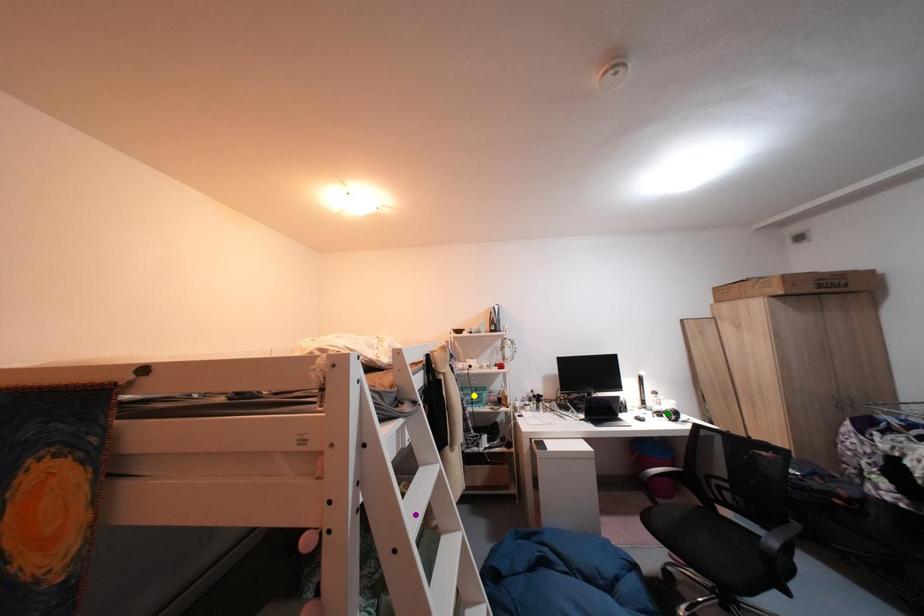
Order these from nearest to farthest:
A) yellow point
B) purple point
C) green point

purple point → yellow point → green point